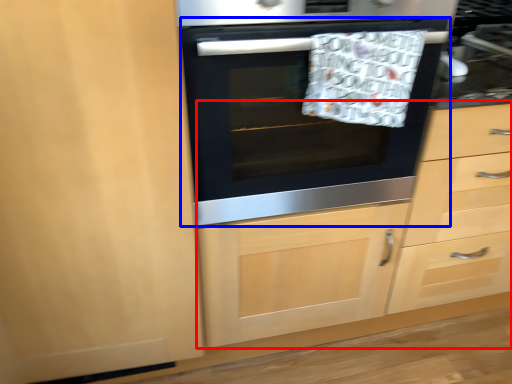
Question: Which object is closer to the camera taking this photo, dresser (highlighted by a red box) or oven (highlighted by a blue box)?

Choices:
 (A) dresser
 (B) oven

Answer: (B)